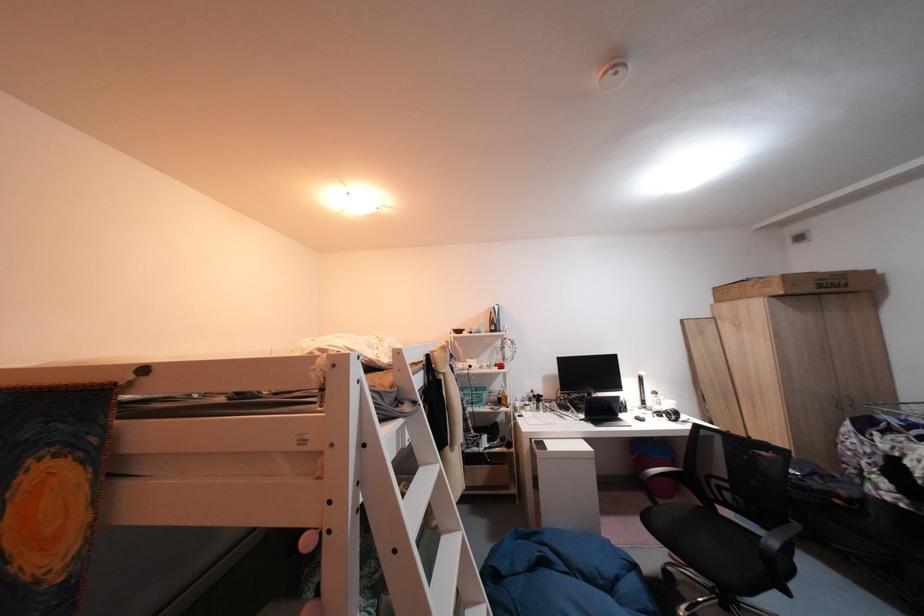
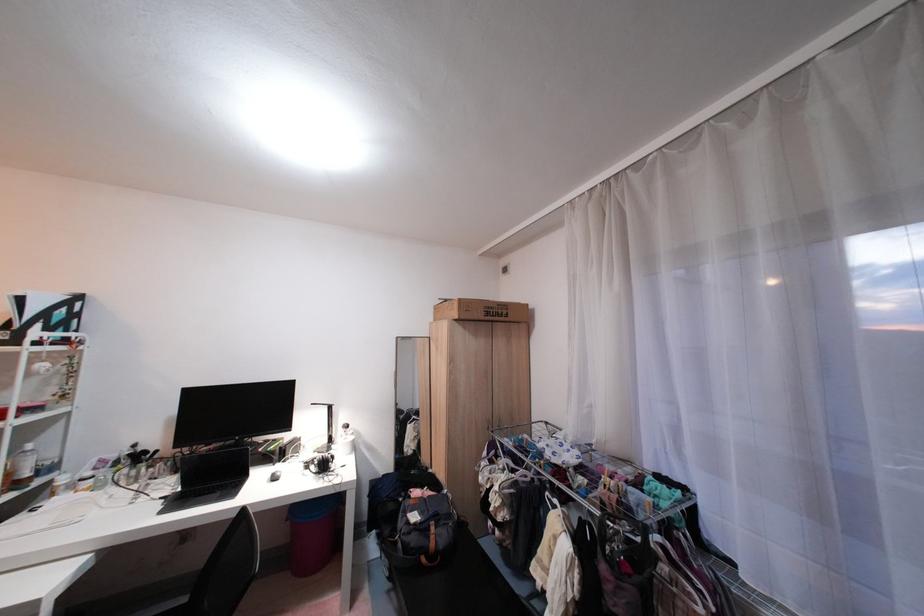
Where in the second image is the point corresponding to point (649, 408) from the first image?

(326, 450)